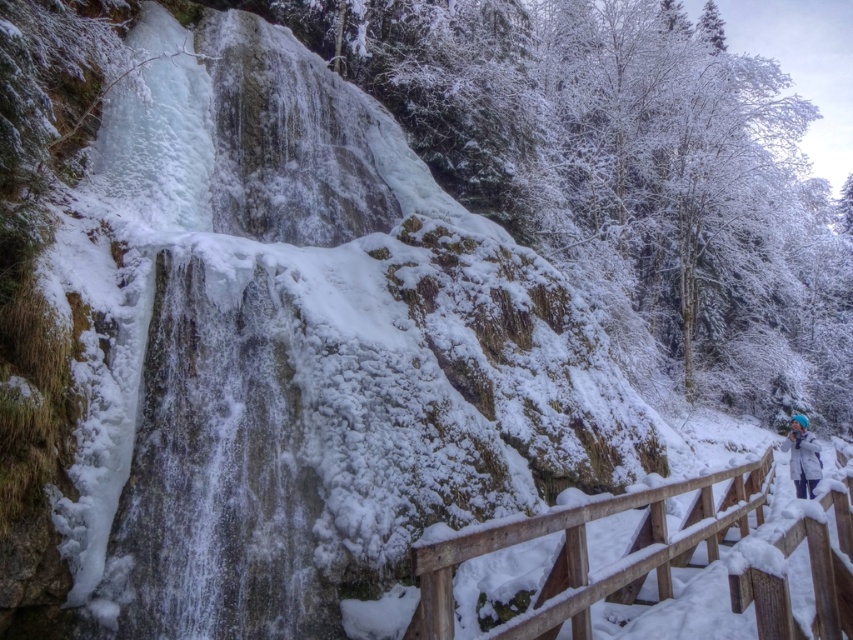
Question: Among these points, which one is farthest from the camera?

Choices:
 (A) pyautogui.click(x=790, y=467)
 (B) pyautogui.click(x=769, y=468)

Answer: (B)

Question: Can you confirm if wooden rail at lower right is thinner than white fleece jacket at lower right?

Choices:
 (A) yes
 (B) no

Answer: (A)

Question: Does wooden rail at lower right lie behind white fleece jacket at lower right?

Choices:
 (A) yes
 (B) no

Answer: (B)

Question: Which object is farther from the camera taking this photo?

Choices:
 (A) white fleece jacket at lower right
 (B) wooden rail at lower right

Answer: (A)

Question: Observing the image, what is the correct spatial positioning of wooden rail at lower right in reference to white fleece jacket at lower right?

Choices:
 (A) left
 (B) right

Answer: (A)